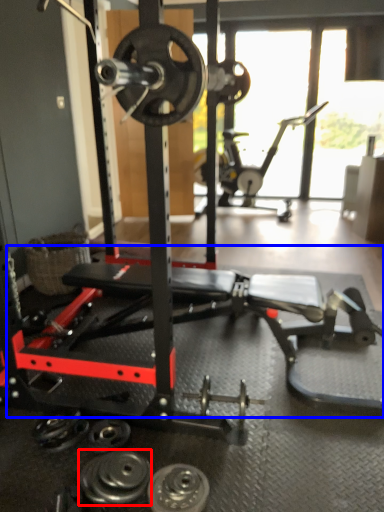
Question: Which object is closer to the camera taking this photo, dumbbell (highlighted by a red box) or training bench (highlighted by a blue box)?

Choices:
 (A) dumbbell
 (B) training bench

Answer: (B)